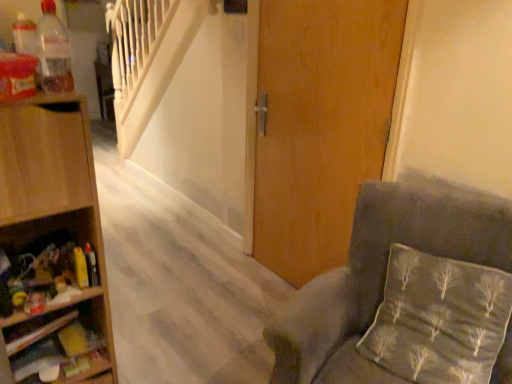
Question: Is wooden shelf at left, positioned as the first shelf in top-to-bottom order, bigger or smaller than velvet grey chair at lower right?

Choices:
 (A) small
 (B) big

Answer: (A)

Question: Is wooden shelf at left, the 2th shelf in the bottom-to-top sequence, in front of or behind velvet grey chair at lower right in the image?

Choices:
 (A) front
 (B) behind

Answer: (B)

Question: Estimate the real-world distances between objects in this image. Which object is farther from the wooden door at center?

Choices:
 (A) transparent plastic bottle at upper left
 (B) velvet grey chair at lower right
 (C) wooden shelves at lower left, which is counted as the 2th shelf, starting from the top
 (D) silky gray pillow at lower right
 (E) wooden shelf at left, positioned as the first shelf in top-to-bottom order

Answer: (C)

Question: Which object is positioned farthest from the silky gray pillow at lower right?

Choices:
 (A) wooden door at center
 (B) wooden shelf at left, positioned as the first shelf in top-to-bottom order
 (C) velvet grey chair at lower right
 (D) wooden shelves at lower left, which is counted as the 2th shelf, starting from the top
 (E) transparent plastic bottle at upper left

Answer: (E)